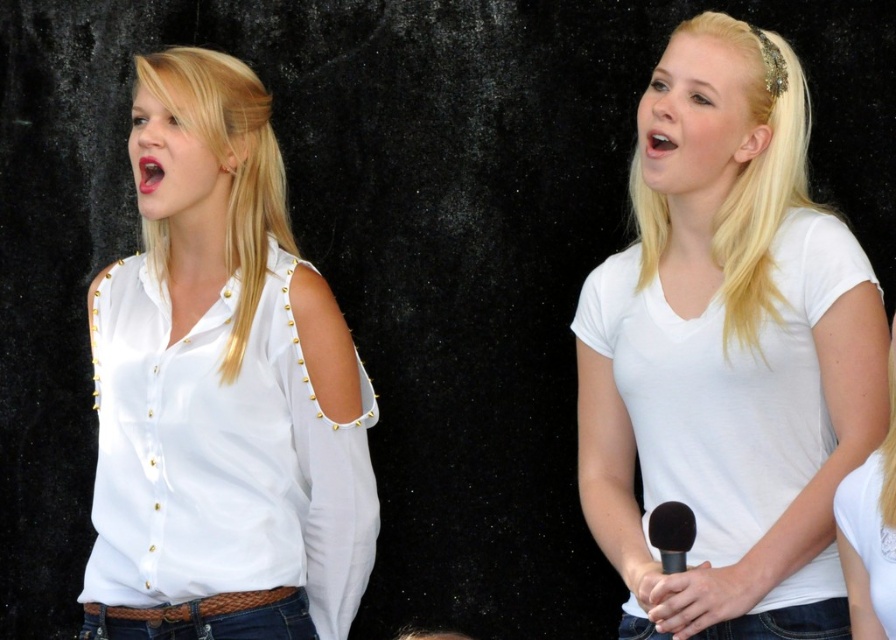
Between point (739, 204) and point (168, 161), which one is positioned behind?

Point (168, 161)

In order to click on white matte shirt at center in this screenshot , I will do `click(728, 352)`.

Where is `white matte shirt at center`? Image resolution: width=896 pixels, height=640 pixels. white matte shirt at center is located at coordinates (728, 352).

Between white matte shirt at center and black matte microphone at lower center, which one is positioned higher?

white matte shirt at center is higher up.

Between point (711, 422) and point (662, 515), which one is positioned behind?

Positioned behind is point (711, 422).

I want to click on white matte shirt at center, so click(x=728, y=352).

Who is lower down, white studded shirt at left or black matte microphone at lower center?

black matte microphone at lower center is lower down.

Does point (98, 390) come behind point (653, 513)?

Yes, point (98, 390) is behind point (653, 513).

Does point (207, 465) lie behind point (662, 536)?

Yes, point (207, 465) is farther from viewer.

The width and height of the screenshot is (896, 640). Find the location of `white studded shirt at left`. white studded shirt at left is located at coordinates (221, 388).